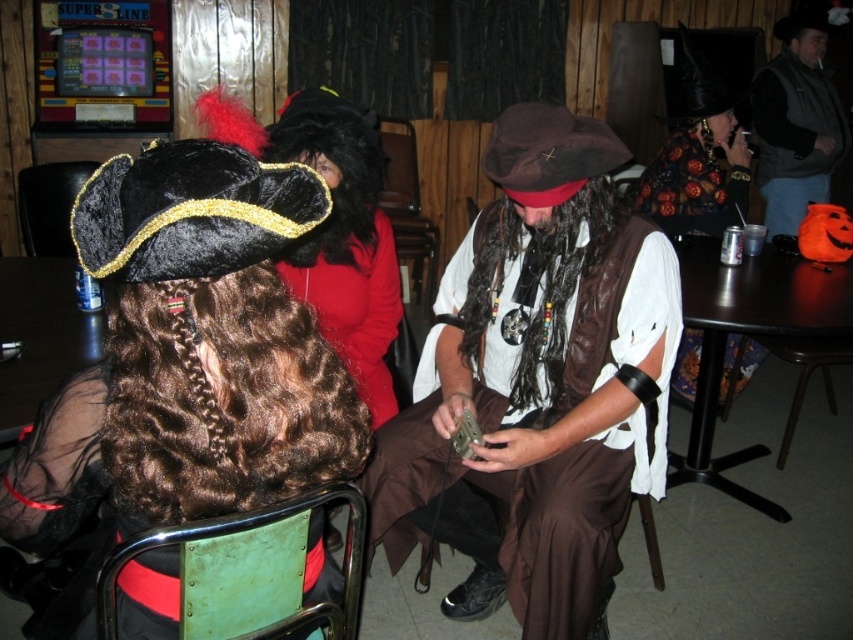
Question: Is brown leather vest at center thinner than black curly wig at center?

Choices:
 (A) no
 (B) yes

Answer: (A)

Question: Can you confirm if velvet pirate hat at upper left is thinner than green metal chair at lower left?

Choices:
 (A) yes
 (B) no

Answer: (B)

Question: Which object is the farthest from the velvet red coat at center?

Choices:
 (A) brown leather vest at center
 (B) velvet pumpkin bag at upper right
 (C) floral-patterned blouse at upper right
 (D) green metal chair at lower left

Answer: (B)

Question: Which object is the farthest from the velvet black chair at left?

Choices:
 (A) brown silky wig at left
 (B) black curly wig at center
 (C) brown leather vest at center
 (D) black silky wig at center

Answer: (A)

Question: Can you confirm if brown silky wig at left is positioned to the left of black curly wig at center?

Choices:
 (A) yes
 (B) no

Answer: (A)

Question: Which point appears closest to the camera in this image?

Choices:
 (A) click(x=200, y=461)
 (B) click(x=16, y=406)
 (C) click(x=397, y=275)
 (D) click(x=306, y=262)

Answer: (A)